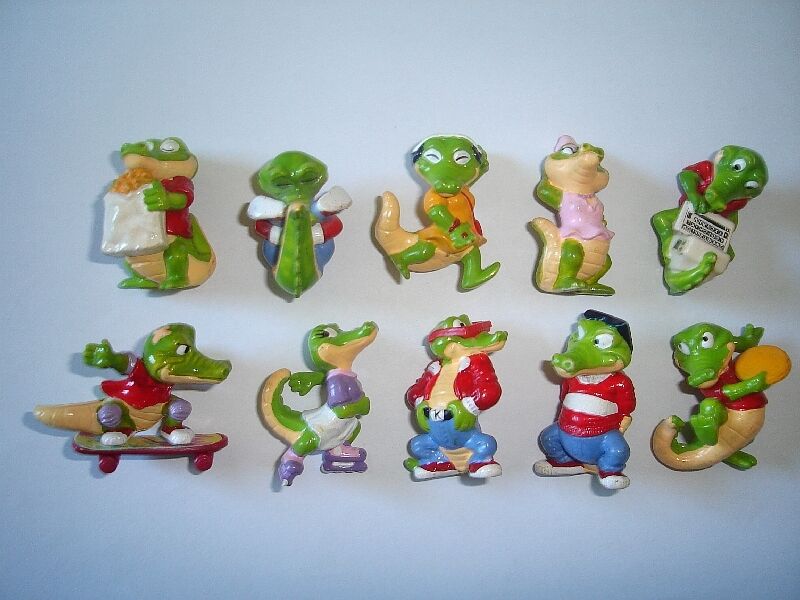
In order to click on crocodile figurines in this screenshot , I will do `click(170, 192)`, `click(182, 367)`, `click(304, 185)`, `click(329, 342)`, `click(453, 161)`, `click(466, 343)`, `click(590, 174)`, `click(600, 351)`, `click(726, 167)`, `click(709, 349)`.